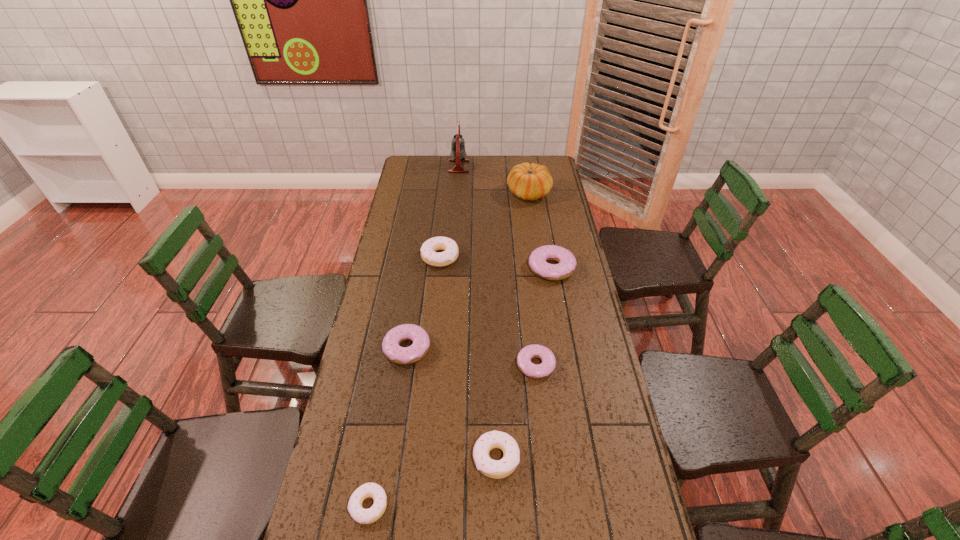
Locate an element on the screen. Image resolution: width=960 pixels, height=540 pixels. the nearest white doughnut is located at coordinates (368, 490).

At what (x,y) coordinates should I click in order to perform the action: click on the nearest doughnut. Please return your answer as a coordinate pair (x, y). Image resolution: width=960 pixels, height=540 pixels. Looking at the image, I should click on (368, 490).

The width and height of the screenshot is (960, 540). I want to click on vacant area located 0.180m on the front of the bell, so click(x=457, y=194).

Identify the location of vacant space located on the front of the gourd. (535, 237).

Identify the location of vacant space located 0.270m on the back of the farthest white doughnut. (445, 207).

Image resolution: width=960 pixels, height=540 pixels. What are the coordinates of `blank space located on the front of the farthest pink doughnut` in the screenshot? It's located at (569, 367).

The height and width of the screenshot is (540, 960). I want to click on vacant space situated 0.130m on the right of the second smallest pink doughnut, so click(x=471, y=348).

I want to click on free location located 0.140m on the back of the fourth doughnut from left to right, so click(x=494, y=392).

Find the location of a particular element. This screenshot has width=960, height=540. vacant space positioned on the back of the smallest pink doughnut is located at coordinates (530, 312).

In order to click on free point located 0.390m on the right of the nearest white doughnut in this screenshot , I will do `click(550, 505)`.